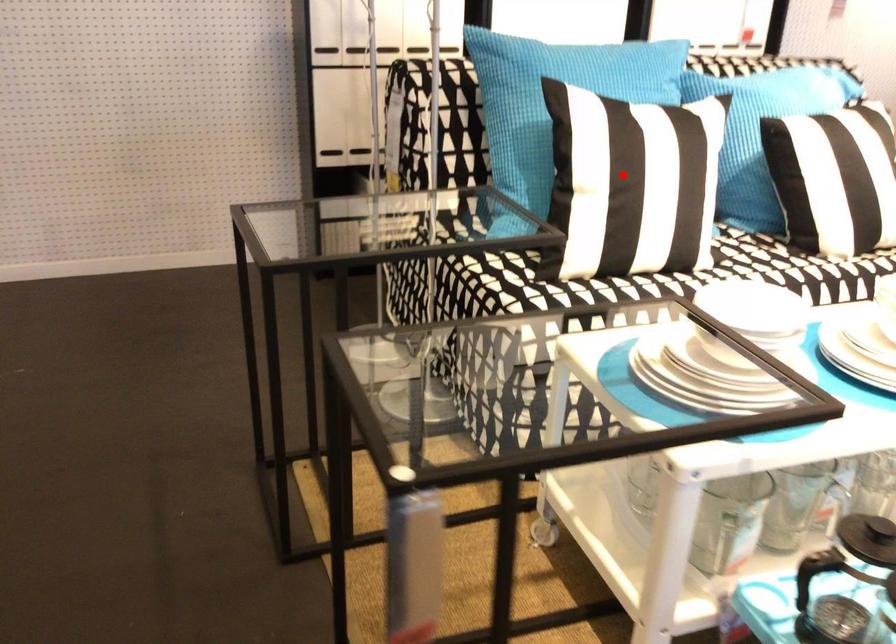
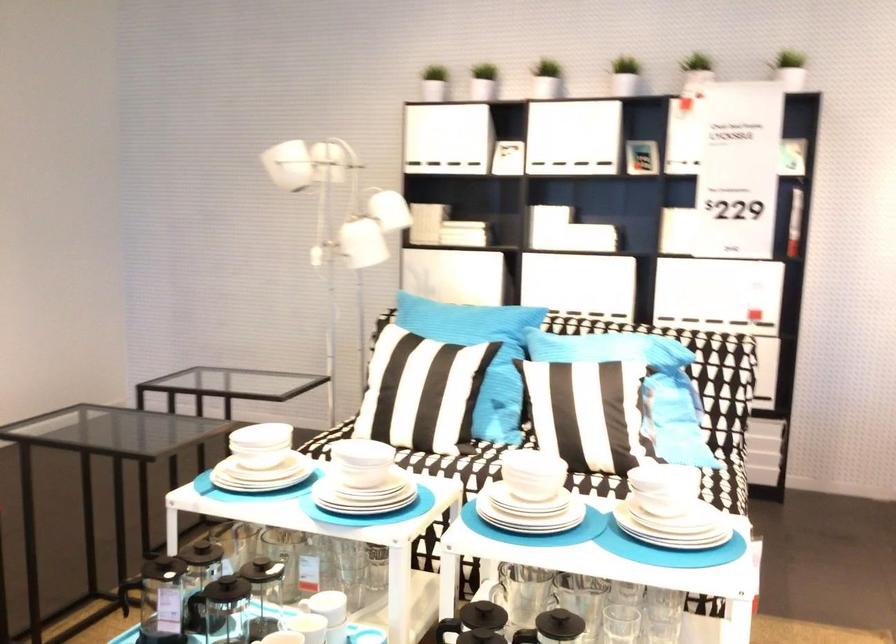
Question: I am providing you with two images of the same scene from different viewpoints. In image1, a red point is highlighted. Considering the same 3D point in image2, which of the following is correct?

Choices:
 (A) It is closer
 (B) It is farther

Answer: (B)